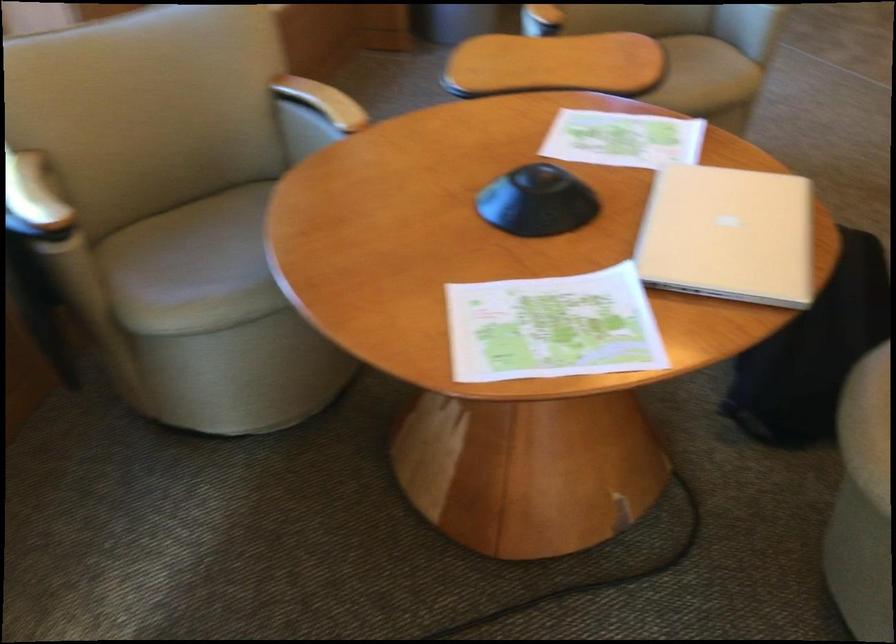
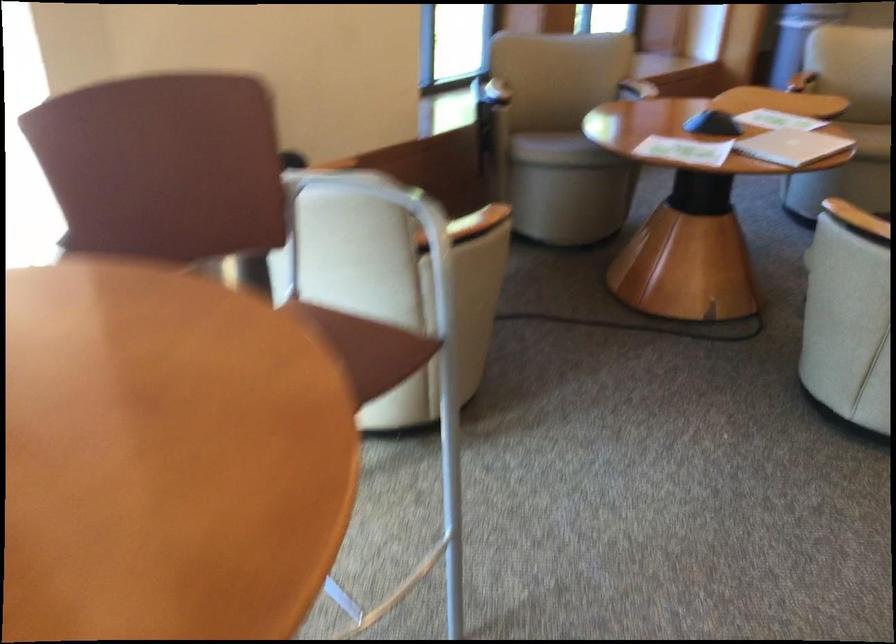
Locate, in the second image, the point that corresponds to the point at 218,327 in the first image.

(561, 149)